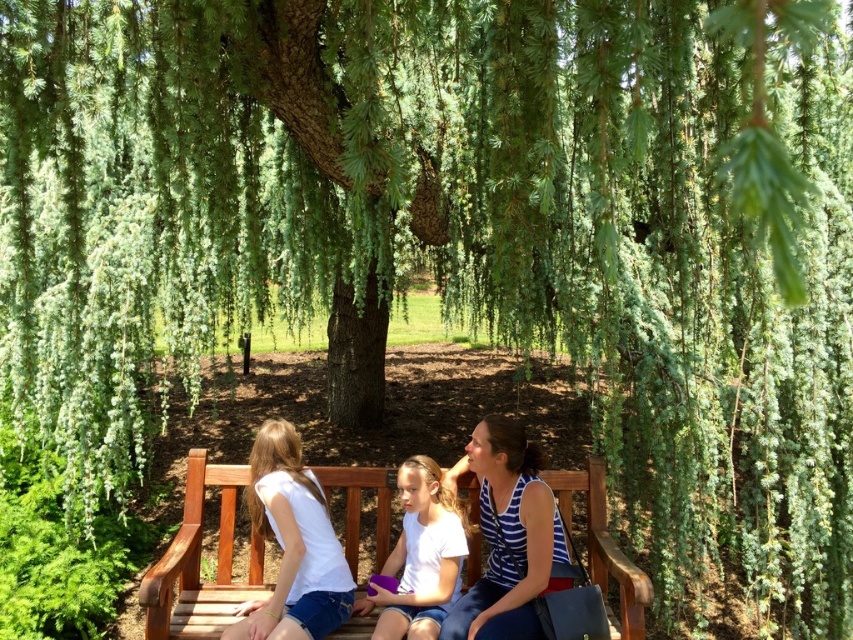
Question: Does striped fabric top at center come behind white cotton shirt at lower left?

Choices:
 (A) no
 (B) yes

Answer: (A)

Question: Can you confirm if striped fabric top at center is positioned to the right of white matte shirt at center?

Choices:
 (A) no
 (B) yes

Answer: (B)

Question: Can you confirm if wooden bench at center is positioned to the right of white cotton shirt at lower left?

Choices:
 (A) yes
 (B) no

Answer: (B)

Question: Based on their relative distances, which object is nearer to the white cotton shirt at lower left?

Choices:
 (A) wooden bench at center
 (B) striped fabric top at center
 (C) white matte shirt at center

Answer: (A)

Question: Which of the following is the farthest from the observer?

Choices:
 (A) (453, 513)
 (B) (602, 464)
 (C) (483, 452)

Answer: (B)

Question: Among these points, which one is farthest from the camera?

Choices:
 (A) (265, 627)
 (B) (503, 419)

Answer: (B)